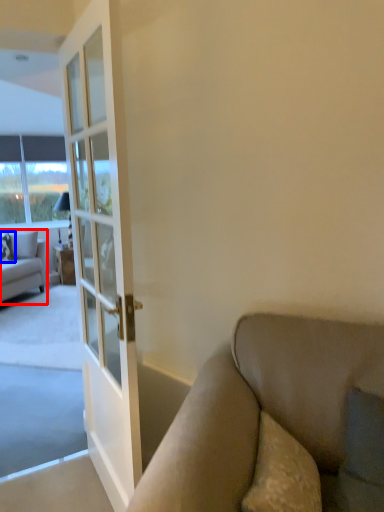
Question: Among these objects, which one is nearest to the camera, studio couch (highlighted by a red box) or pillow (highlighted by a blue box)?

Choices:
 (A) studio couch
 (B) pillow

Answer: (A)